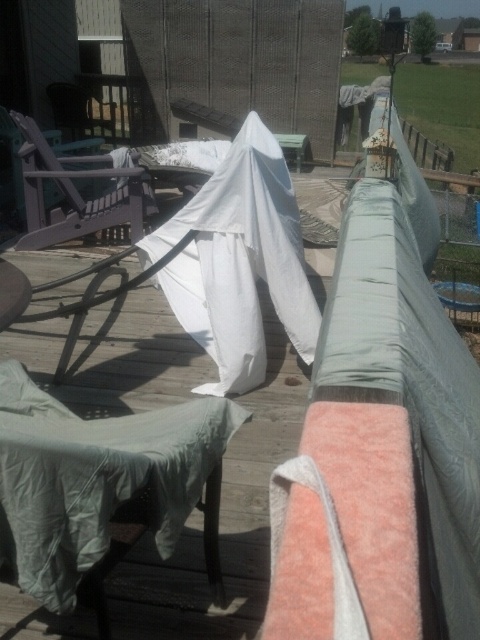
You are setting up a garden party and need to arrange chairs. You have a green fabric chair at lower left and a matte purple chair at left. Which chair should you choose if you want the shorter one for the children area?

The green fabric chair at lower left is shorter than the matte purple chair at left, so you should choose the green fabric chair at lower left for the children area.